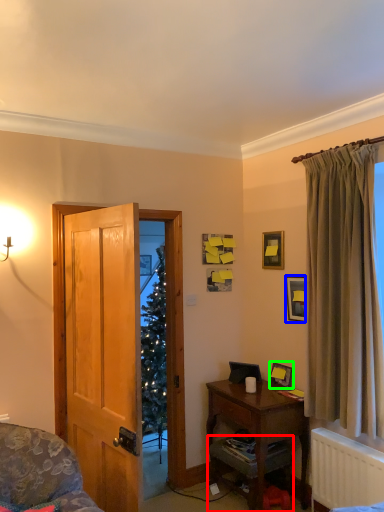
Question: Considering the real-world distances, which object is closest to cabinetry (highlighted by a red box)? picture frame (highlighted by a blue box) or picture frame (highlighted by a green box).

Choices:
 (A) picture frame
 (B) picture frame

Answer: (B)